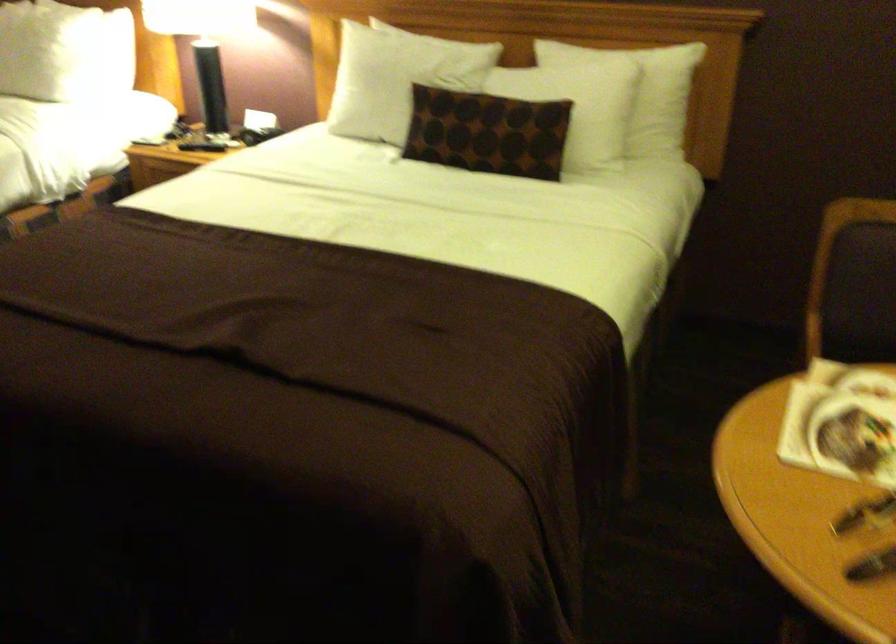
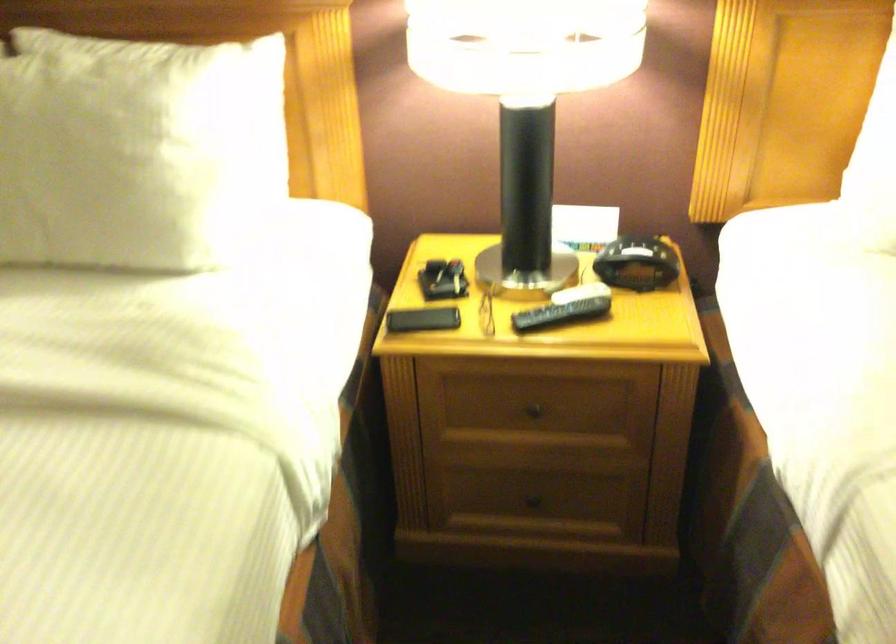
What movement of the cameraman would produce the second image?

The movement direction of the cameraman is left, forward.